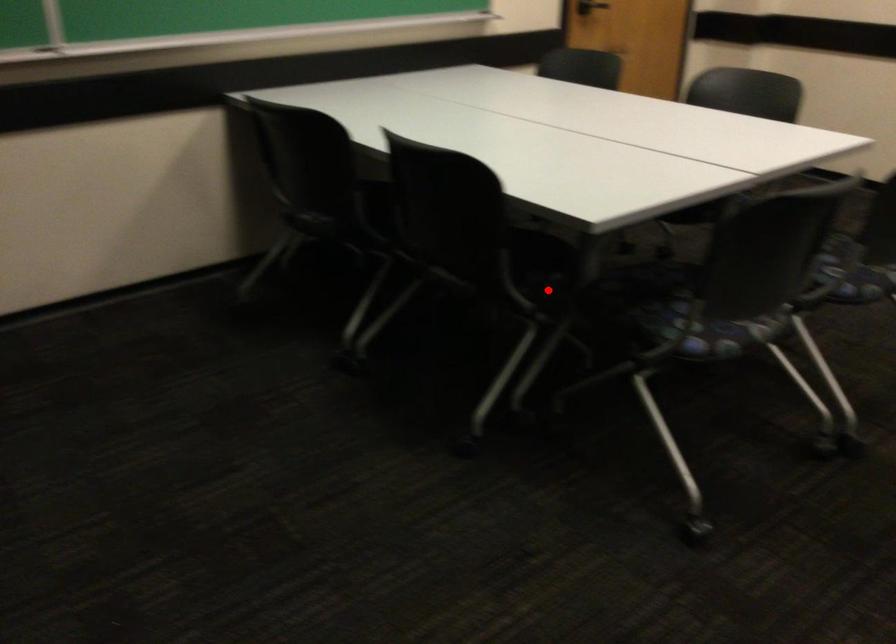
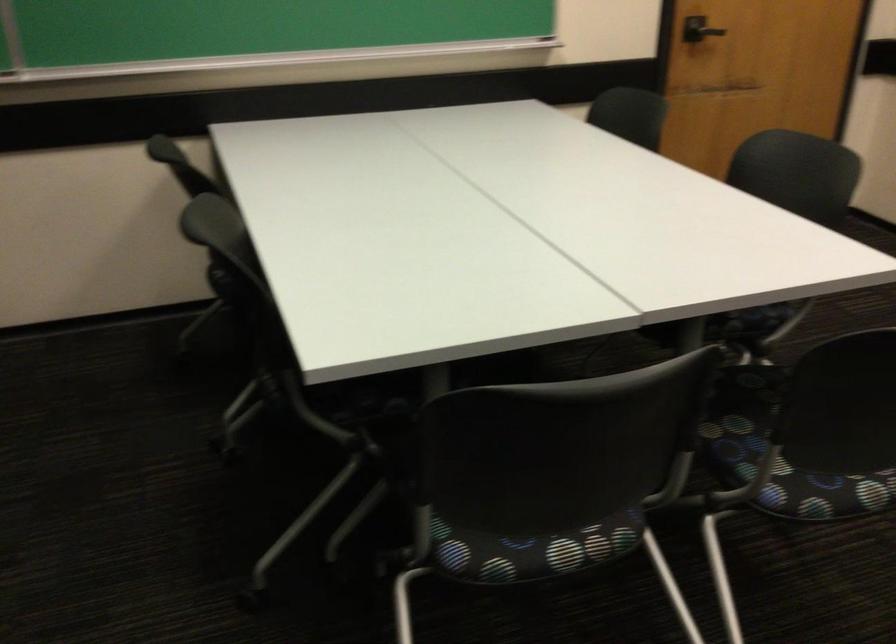
Find the pixel in the second image that matches the highlighted location in the first image.

(376, 413)